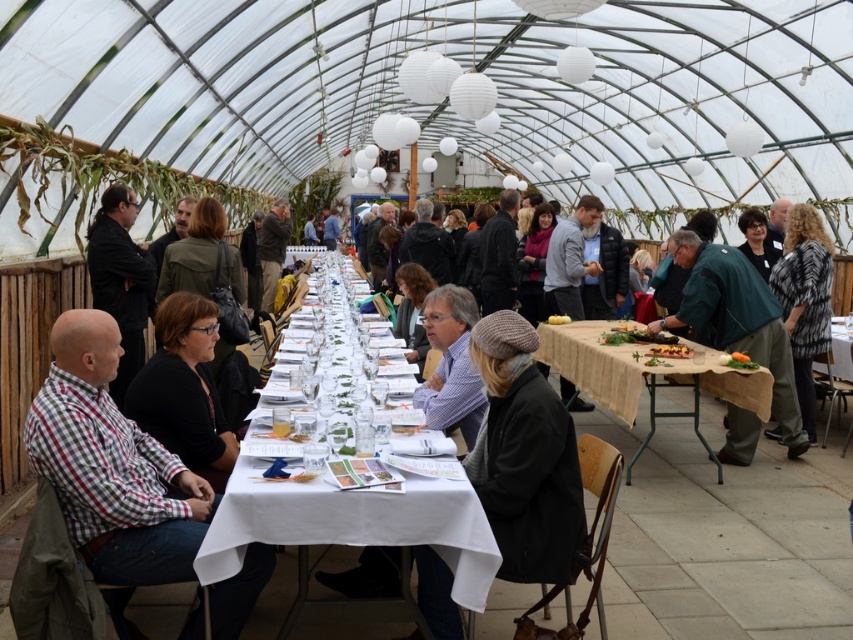
You are a photographer positioned at the camera location. You want to capture a closeup shot of the checkered fabric shirt at left without moving the camera. Is it possible to do so with a standard zoom lens that has a maximum zoom range of 2 meters?

The checkered fabric shirt at left is 2.55 meters away from the camera. Since the maximum zoom range is 2 meters, the photographer cannot capture a closeup shot without moving the camera because the distance exceeds the lens capability.

You are a photographer positioned at the center of the greenhouse. You want to capture a photo that includes the black fabric jacket at lower left. Based on the coordinates provided, where should you aim your camera to ensure the jacket is in the frame?

The black fabric jacket at lower left is located at coordinates (184, 388), so you should aim your camera towards that point to include it in the frame.